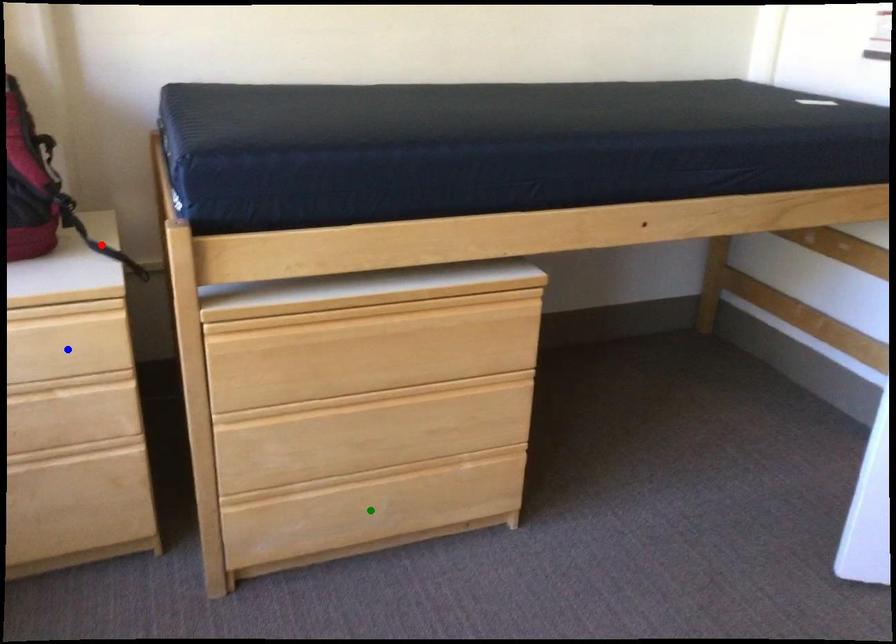
Order these from nearest to farthest:
A) blue point
B) red point
C) green point

blue point < red point < green point